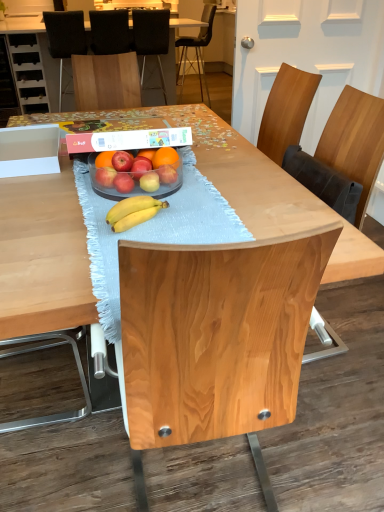
Find the location of `free region on the left part of matte red apple at center, placed as the 6th apple when sorted from left to right`. free region on the left part of matte red apple at center, placed as the 6th apple when sorted from left to right is located at coordinates (119, 191).